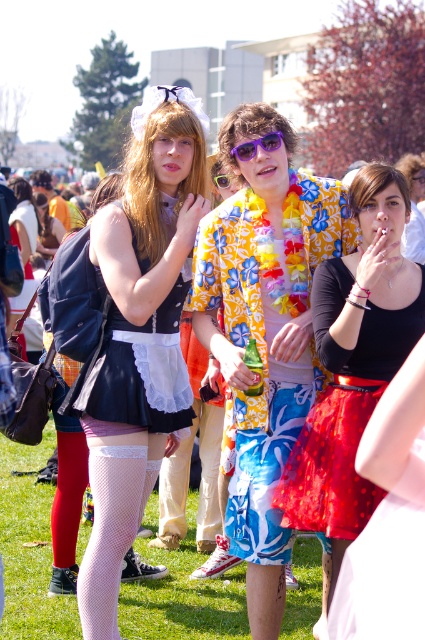
Question: Is floral fabric skirt at center wider than white lace dress at center?

Choices:
 (A) no
 (B) yes

Answer: (B)

Question: Does green grass at lower center appear on the left side of shiny red tulle skirt at center?

Choices:
 (A) yes
 (B) no

Answer: (A)

Question: Which point is farther to the camera?

Choices:
 (A) (218, 620)
 (B) (323, 436)

Answer: (A)

Question: Is floral fabric skirt at center below fishnet stocking at lower left?

Choices:
 (A) yes
 (B) no

Answer: (B)

Question: Which of the following is the closest to the observer?

Choices:
 (A) (5, 502)
 (B) (282, 138)

Answer: (B)

Question: Among these objects, which one is nearest to the camera?

Choices:
 (A) fishnet stocking at lower left
 (B) purple plastic sunglasses at center
 (C) matte white apron at center
 (D) green grass at lower center

Answer: (A)